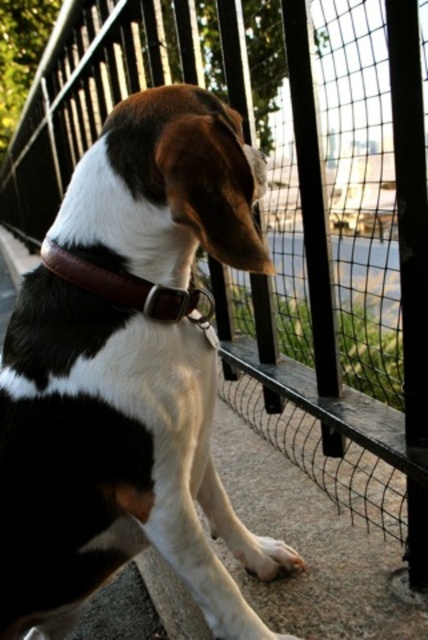
Question: Does black and white fur at center appear over brown leather collar at center?

Choices:
 (A) yes
 (B) no

Answer: (B)

Question: Does black and white fur at center appear on the left side of brown leather collar at center?

Choices:
 (A) yes
 (B) no

Answer: (B)

Question: Among these objects, which one is farthest from the camera?

Choices:
 (A) brown leather collar at center
 (B) black and white fur at center

Answer: (A)

Question: Is black and white fur at center positioned at the back of brown leather collar at center?

Choices:
 (A) yes
 (B) no

Answer: (B)